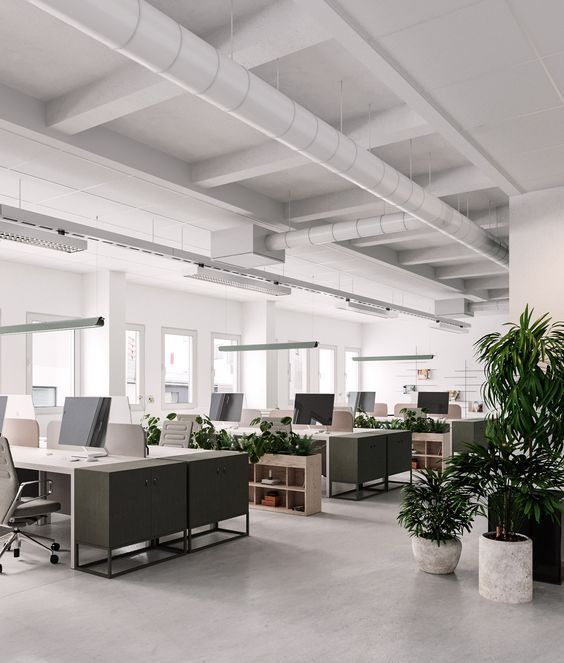
Find the location of a particular element. lights is located at coordinates (451, 324), (358, 300), (236, 284), (58, 244), (70, 323), (246, 345), (399, 353).